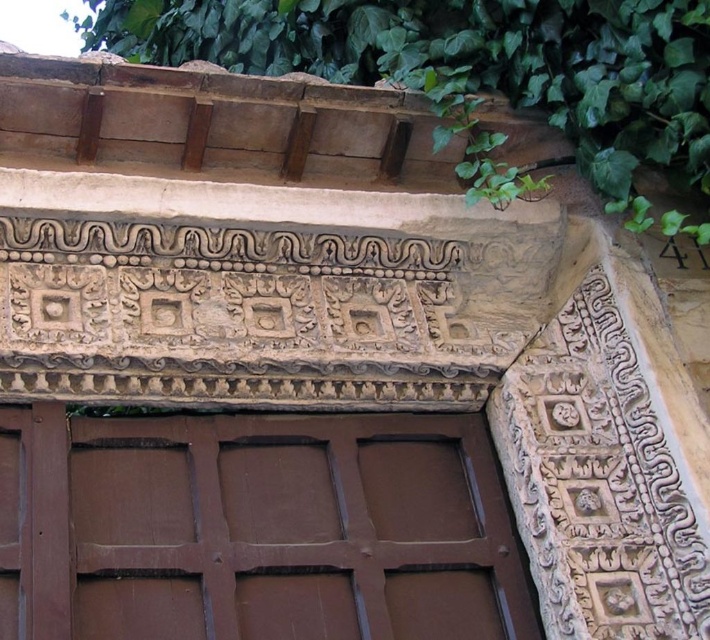
Question: Which point is farther to the camera?

Choices:
 (A) (217, 621)
 (B) (497, 184)

Answer: (B)

Question: Can you confirm if brown wooden door at center is positioned to the left of green leafy ivy at upper center?

Choices:
 (A) yes
 (B) no

Answer: (B)

Question: Can you confirm if brown wooden door at center is positioned to the left of green leafy ivy at upper center?

Choices:
 (A) no
 (B) yes

Answer: (A)

Question: Is brown wooden door at center further to camera compared to green leafy ivy at upper center?

Choices:
 (A) no
 (B) yes

Answer: (A)